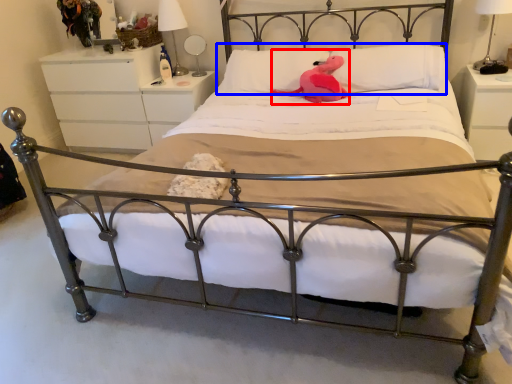
Question: Which point is further to the camera, animal (highlighted by a red box) or pillow (highlighted by a blue box)?

Choices:
 (A) animal
 (B) pillow

Answer: (A)